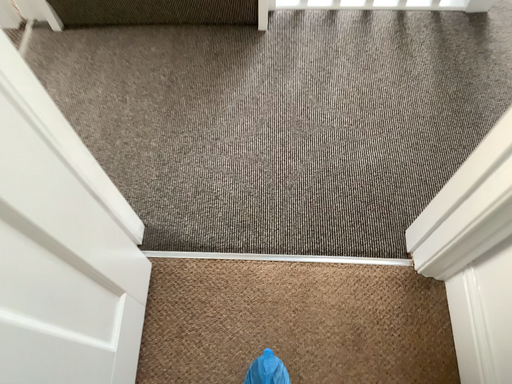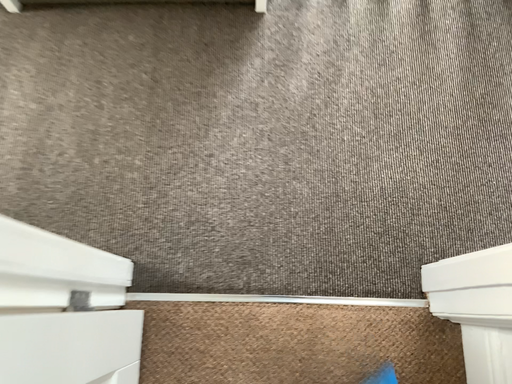
Question: How did the camera likely rotate when shooting the video?

Choices:
 (A) rotated upward
 (B) rotated downward

Answer: (B)